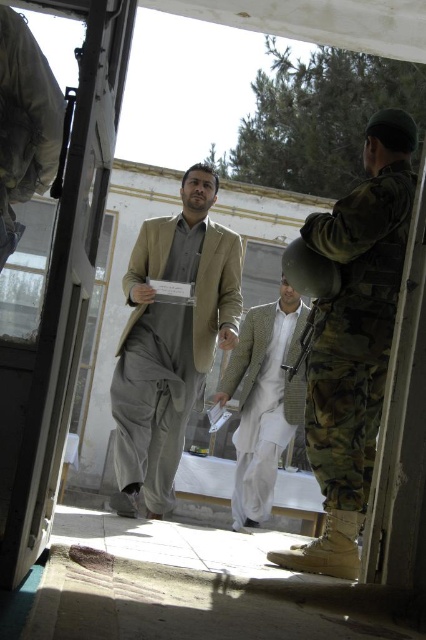
You are a security guard at the entrance of the building. You need to check the width of the camo uniform helmet at right and the matte beige suit at center to ensure they fit through a narrow doorway. Which object has a smaller width?

The camo uniform helmet at right has a smaller width than the matte beige suit at center according to the description.

You are a security guard at the entrance. You see the camo uniform helmet at right and the matte beige suit at center. Which object is positioned higher in the scene?

The camo uniform helmet at right is positioned higher than the matte beige suit at center.

You are a security guard at the entrance of the building. You see the camo uniform helmet at right and the light brown textured suit at center. Which object is nearer to you?

The camo uniform helmet at right is closer to the viewer than the light brown textured suit at center.